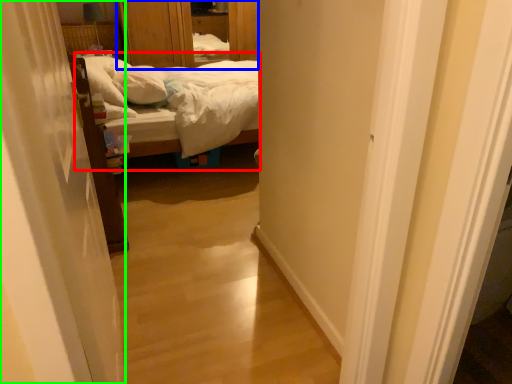
Question: Which object is the closest to the bed (highlighted by a red box)? Choose among these: dresser (highlighted by a blue box) or curtain (highlighted by a green box).

Choices:
 (A) dresser
 (B) curtain

Answer: (B)